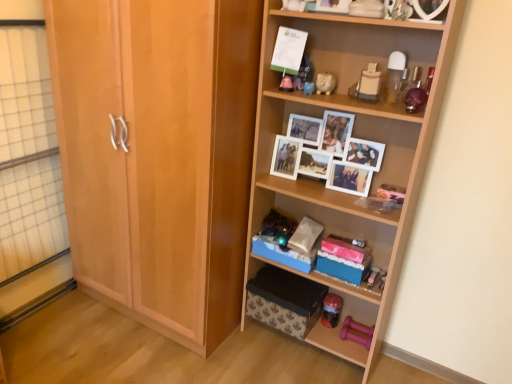
Image resolution: width=512 pixels, height=384 pixels. Describe the element at coordinates (159, 155) in the screenshot. I see `light brown wood cabinet at left` at that location.

Where is `light brown wood cabinet at left`? light brown wood cabinet at left is located at coordinates (159, 155).

Where is `translucent plastic jar at lower center, the sixth toy positioned from the top`? translucent plastic jar at lower center, the sixth toy positioned from the top is located at coordinates (331, 310).

The width and height of the screenshot is (512, 384). I want to click on white matte picture frame at upper center, so click(x=333, y=6).

The width and height of the screenshot is (512, 384). I want to click on matte pink piggy bank at upper center, positioned as the fourth toy in bottom-to-top order, so click(x=308, y=88).

You are a GUI agent. You are given a task and a screenshot of the screen. Output one action in this format:
    pyautogui.click(x=<x>, y=<y>)
    Task: Click on the white paper at upper center
    This screenshot has height=384, width=512.
    Given the screenshot: What is the action you would take?
    pyautogui.click(x=288, y=50)

In order to click on light brown wood cabinet at left in this screenshot , I will do `click(159, 155)`.

Which is in front, matte plastic toy at upper center, the 5th toy when ordered from bottom to top, or translucent plastic jar at lower center, placed as the 2th toy when sorted from bottom to top?

matte plastic toy at upper center, the 5th toy when ordered from bottom to top.

Based on the photo, considering the sizes of objects matte plastic toy at upper center, the 5th toy when ordered from bottom to top, and translucent plastic jar at lower center, placed as the 2th toy when sorted from bottom to top, in the image provided, who is wider, matte plastic toy at upper center, the 5th toy when ordered from bottom to top, or translucent plastic jar at lower center, placed as the 2th toy when sorted from bottom to top,?

matte plastic toy at upper center, the 5th toy when ordered from bottom to top, is wider.

How different are the orientations of matte plastic toy at upper center, arranged as the 3th toy when viewed from the top, and translucent plastic jar at lower center, placed as the 2th toy when sorted from bottom to top, in degrees?

0.518 degrees.

From the image's perspective, is matte plastic toy at upper center, arranged as the 3th toy when viewed from the top, located above or below translucent plastic jar at lower center, the sixth toy positioned from the top?

matte plastic toy at upper center, arranged as the 3th toy when viewed from the top, is above translucent plastic jar at lower center, the sixth toy positioned from the top.

Would you say white matte picture frame at upper center is part of white matte piggy bank at upper center, which is the 1th toy from top to bottom,'s contents?

No, white matte picture frame at upper center is not surrounded by white matte piggy bank at upper center, which is the 1th toy from top to bottom.

Considering the sizes of objects white matte piggy bank at upper center, which is the 1th toy from top to bottom, and white matte picture frame at upper center in the image provided, who is taller, white matte piggy bank at upper center, which is the 1th toy from top to bottom, or white matte picture frame at upper center?

white matte picture frame at upper center.

Between white matte piggy bank at upper center, the 7th toy in the bottom-to-top sequence, and white matte picture frame at upper center, which one has larger width?

white matte picture frame at upper center is wider.

Identify the location of the 1st toy below the white matte picture frame at upper center (from a real-world perspective). This screenshot has width=512, height=384. (294, 5).

Is rubber pink dumbbell at lower right, the third toy positioned from the bottom, to the left or to the right of light brown wood cabinet at left in the image?

In the image, rubber pink dumbbell at lower right, the third toy positioned from the bottom, appears on the right side of light brown wood cabinet at left.

Looking at their sizes, would you say rubber pink dumbbell at lower right, the third toy positioned from the bottom, is wider or thinner than light brown wood cabinet at left?

In the image, rubber pink dumbbell at lower right, the third toy positioned from the bottom, appears to be more narrow than light brown wood cabinet at left.

From a real-world perspective, who is located lower, rubber pink dumbbell at lower right, the third toy positioned from the bottom, or light brown wood cabinet at left?

rubber pink dumbbell at lower right, the third toy positioned from the bottom.

In the image, is rubber pink dumbbell at lower right, the third toy positioned from the bottom, positioned in front of or behind light brown wood cabinet at left?

rubber pink dumbbell at lower right, the third toy positioned from the bottom, is behind light brown wood cabinet at left.

Does light brown wood cabinet at left have a smaller size compared to white wooden photo frames at center?

Actually, light brown wood cabinet at left might be larger than white wooden photo frames at center.

Is light brown wood cabinet at left to the right of white wooden photo frames at center from the viewer's perspective?

Incorrect, light brown wood cabinet at left is not on the right side of white wooden photo frames at center.

Which is nearer, (x=170, y=265) or (x=265, y=137)?

Point (x=170, y=265).

From a real-world perspective, between light brown wood cabinet at left and white wooden photo frames at center, who is vertically higher?

In real-world perspective, white wooden photo frames at center is above.

Is translucent plastic jar at lower center, the sixth toy positioned from the top, aimed at white matte piggy bank at upper center, the 7th toy in the bottom-to-top sequence?

No, translucent plastic jar at lower center, the sixth toy positioned from the top, is not facing towards white matte piggy bank at upper center, the 7th toy in the bottom-to-top sequence.

Does point (325, 306) lie in front of point (287, 3)?

No, it is not.

Locate an element on the screen. the 5th toy below when counting from the white matte piggy bank at upper center, the 7th toy in the bottom-to-top sequence (from the image's perspective) is located at coordinates (331, 310).

Looking at this image, who is shorter, translucent plastic jar at lower center, placed as the 2th toy when sorted from bottom to top, or white matte piggy bank at upper center, which is the 1th toy from top to bottom?

white matte piggy bank at upper center, which is the 1th toy from top to bottom.

Can you confirm if pink rubber dumbbells at lower right, positioned as the 1th toy in bottom-to-top order, is taller than translucent plastic jar at lower center, the sixth toy positioned from the top?

Incorrect, the height of pink rubber dumbbells at lower right, positioned as the 1th toy in bottom-to-top order, is not larger of that of translucent plastic jar at lower center, the sixth toy positioned from the top.

Is pink rubber dumbbells at lower right, positioned as the 1th toy in bottom-to-top order, positioned with its back to translucent plastic jar at lower center, placed as the 2th toy when sorted from bottom to top?

→ No, translucent plastic jar at lower center, placed as the 2th toy when sorted from bottom to top, is not at the back of pink rubber dumbbells at lower right, positioned as the 1th toy in bottom-to-top order.

In the scene shown: How distant is pink rubber dumbbells at lower right, positioned as the 1th toy in bottom-to-top order, from translucent plastic jar at lower center, the sixth toy positioned from the top?

pink rubber dumbbells at lower right, positioned as the 1th toy in bottom-to-top order, is 3.41 inches away from translucent plastic jar at lower center, the sixth toy positioned from the top.

From the image's perspective, does pink rubber dumbbells at lower right, positioned as the 1th toy in bottom-to-top order, appear higher than translucent plastic jar at lower center, the sixth toy positioned from the top?

No, from the image's perspective, pink rubber dumbbells at lower right, positioned as the 1th toy in bottom-to-top order, is not on top of translucent plastic jar at lower center, the sixth toy positioned from the top.

From their relative heights in the image, would you say white matte picture frame at upper center is taller or shorter than matte plastic toy at upper center, the 5th toy when ordered from bottom to top?

white matte picture frame at upper center is taller than matte plastic toy at upper center, the 5th toy when ordered from bottom to top.

From the image's perspective, is white matte picture frame at upper center located above matte plastic toy at upper center, the 5th toy when ordered from bottom to top?

Indeed, from the image's perspective, white matte picture frame at upper center is shown above matte plastic toy at upper center, the 5th toy when ordered from bottom to top.

From a real-world perspective, is white matte picture frame at upper center physically below matte plastic toy at upper center, the 5th toy when ordered from bottom to top?

Incorrect, from a real-world perspective, white matte picture frame at upper center is higher than matte plastic toy at upper center, the 5th toy when ordered from bottom to top.

Which toy is the 5th one when counting from the back of the matte plastic toy at upper center, the 5th toy when ordered from bottom to top? Please provide its 2D coordinates.

[(331, 310)]

Find the location of `picture frame located in front of the white matte piggy bank at upper center, which is the 1th toy from top to bottom`. picture frame located in front of the white matte piggy bank at upper center, which is the 1th toy from top to bottom is located at coordinates (333, 6).

Which object lies nearer to the anchor point white glossy piggy bank at upper center, marked as the 6th toy in a bottom-to-top arrangement, white matte picture frame at upper center or white matte piggy bank at upper center, which is the 1th toy from top to bottom?

white matte picture frame at upper center is closer to white glossy piggy bank at upper center, marked as the 6th toy in a bottom-to-top arrangement.

Which object lies further to the anchor point transparent glass door at left, light brown wood cabinet at left or white paper at upper center?

white paper at upper center.

Estimate the real-world distances between objects in this image. Which object is further from translucent plastic jar at lower center, placed as the 2th toy when sorted from bottom to top, white glossy piggy bank at upper center, the second toy viewed from the top, or white matte picture frame at upper center?

The object further to translucent plastic jar at lower center, placed as the 2th toy when sorted from bottom to top, is white matte picture frame at upper center.

In the scene shown: Based on their spatial positions, is matte plastic toy at upper center, arranged as the 3th toy when viewed from the top, or pink rubber dumbbells at lower right, marked as the 7th toy in a top-to-bottom arrangement, closer to translucent plastic jar at lower center, the sixth toy positioned from the top?

pink rubber dumbbells at lower right, marked as the 7th toy in a top-to-bottom arrangement.

Estimate the real-world distances between objects in this image. Which object is further from white glossy piggy bank at upper center, marked as the 6th toy in a bottom-to-top arrangement, matte plastic toy at upper center, arranged as the 3th toy when viewed from the top, or pink rubber dumbbells at lower right, marked as the 7th toy in a top-to-bottom arrangement?

The object further to white glossy piggy bank at upper center, marked as the 6th toy in a bottom-to-top arrangement, is pink rubber dumbbells at lower right, marked as the 7th toy in a top-to-bottom arrangement.

When comparing their distances from light brown wood cabinet at left, does matte plastic toy at upper center, the 5th toy when ordered from bottom to top, or white glossy piggy bank at upper center, marked as the 6th toy in a bottom-to-top arrangement, seem further?

matte plastic toy at upper center, the 5th toy when ordered from bottom to top, lies further to light brown wood cabinet at left than the other object.

From the image, which object appears to be farther from white matte piggy bank at upper center, the 7th toy in the bottom-to-top sequence, transparent glass door at left or matte plastic toy at upper center, arranged as the 3th toy when viewed from the top?

transparent glass door at left.

From the image, which object appears to be farther from matte plastic toy at upper center, the 5th toy when ordered from bottom to top, translucent plastic jar at lower center, placed as the 2th toy when sorted from bottom to top, or rubber pink dumbbell at lower right, the third toy positioned from the bottom?

translucent plastic jar at lower center, placed as the 2th toy when sorted from bottom to top.

Find the location of a particular element. Image resolution: width=512 pixels, height=384 pixels. shelf between white matte piggy bank at upper center, the 7th toy in the bottom-to-top sequence, and rubber pink dumbbell at lower right, positioned as the 5th toy in top-to-bottom order, from top to bottom is located at coordinates (354, 134).

Where is `cabinetry located between transparent glass door at left and pink rubber dumbbells at lower right, positioned as the 1th toy in bottom-to-top order, in the left-right direction`? This screenshot has width=512, height=384. cabinetry located between transparent glass door at left and pink rubber dumbbells at lower right, positioned as the 1th toy in bottom-to-top order, in the left-right direction is located at coordinates (159, 155).

Where is `cabinetry between transparent glass door at left and rubber pink dumbbell at lower right, the third toy positioned from the bottom, from left to right`? Image resolution: width=512 pixels, height=384 pixels. cabinetry between transparent glass door at left and rubber pink dumbbell at lower right, the third toy positioned from the bottom, from left to right is located at coordinates (159, 155).

I want to click on shelf between light brown wood cabinet at left and rubber pink dumbbell at lower right, positioned as the 5th toy in top-to-bottom order, in the horizontal direction, so click(x=354, y=134).